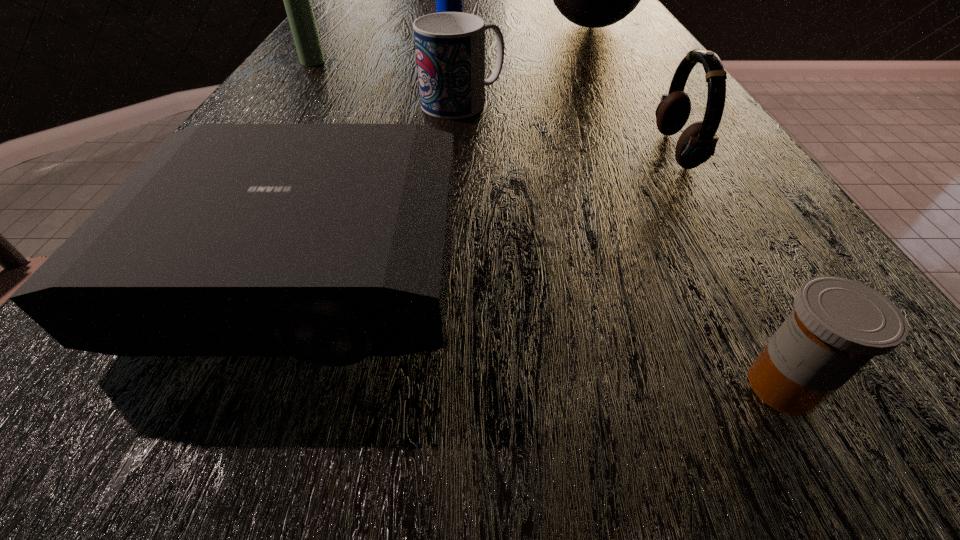
At what (x,y) coordinates should I click in order to perform the action: click on flower arrangement. Please return your answer as a coordinate pair (x, y). Looking at the image, I should click on (594, 0).

Where is `water bottle`? water bottle is located at coordinates (447, 0).

The image size is (960, 540). I want to click on the fifth nearest object, so click(x=297, y=0).

At what (x,y) coordinates should I click in order to perform the action: click on the fifth farthest object. Please return your answer as a coordinate pair (x, y). This screenshot has width=960, height=540. Looking at the image, I should click on (697, 143).

In order to click on the fourth farthest object in this screenshot , I will do `click(450, 46)`.

This screenshot has height=540, width=960. What are the coordinates of `projector` in the screenshot? It's located at (328, 242).

The height and width of the screenshot is (540, 960). In order to click on medicine in this screenshot , I will do `click(838, 325)`.

Identify the location of free space located 0.330m on the front of the tallest object. The height and width of the screenshot is (540, 960). (634, 121).

You are a GUI agent. You are given a task and a screenshot of the screen. Output one action in this format:
    pyautogui.click(x=<x>, y=<y>)
    Task: Click on the vacant point located on the left of the water bottle
    
    Given the screenshot: What is the action you would take?
    pyautogui.click(x=339, y=28)

This screenshot has height=540, width=960. What are the coordinates of `vacant space located 0.270m on the right of the thermos bottle` in the screenshot? It's located at (444, 62).